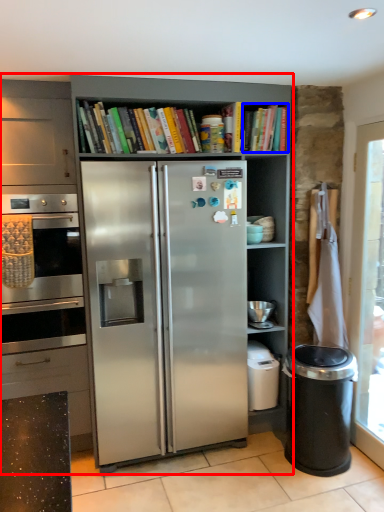
Question: Which object is closer to the camera taking this photo, cupboard (highlighted by a red box) or book (highlighted by a blue box)?

Choices:
 (A) cupboard
 (B) book

Answer: (A)